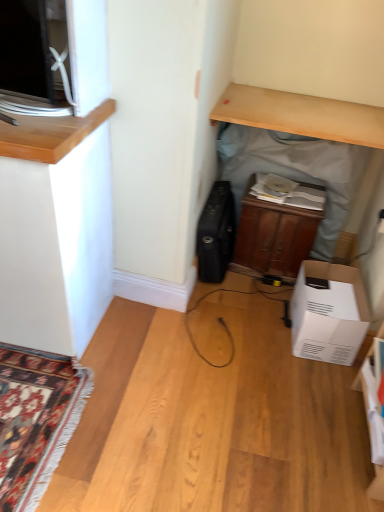
This screenshot has width=384, height=512. Describe the element at coordinates (274, 234) in the screenshot. I see `wooden cabinet at center` at that location.

What do you see at coordinates (216, 233) in the screenshot?
I see `black matte suitcase at center` at bounding box center [216, 233].

Where is `light wood desk at upper center`? This screenshot has width=384, height=512. light wood desk at upper center is located at coordinates (301, 115).

Considering the relative sizes of black matte suitcase at center and light wood desk at upper center in the image provided, is black matte suitcase at center smaller than light wood desk at upper center?

Actually, black matte suitcase at center might be larger than light wood desk at upper center.

In terms of height, does black matte suitcase at center look taller or shorter compared to light wood desk at upper center?

Considering their sizes, black matte suitcase at center has more height than light wood desk at upper center.

Which is closer to the camera, (231, 248) or (343, 115)?

The point (343, 115) is in front.

What are the coordinates of `desk above the black matte suitcase at center (from the image's perspective)` in the screenshot? It's located at click(x=301, y=115).

Is black matte suitcase at center beside wooden cabinet at center?

black matte suitcase at center is not next to wooden cabinet at center, and they're not touching.

Which of these two, black matte suitcase at center or wooden cabinet at center, is bigger?

With larger size is wooden cabinet at center.

How different are the orientations of black matte suitcase at center and wooden cabinet at center in degrees?

The angle between the facing direction of black matte suitcase at center and the facing direction of wooden cabinet at center is 5.87 degrees.

Is wooden cabinet at center touching black matte suitcase at center?

No, wooden cabinet at center is not making contact with black matte suitcase at center.

Who is taller, wooden cabinet at center or black matte suitcase at center?

Standing taller between the two is wooden cabinet at center.

Does point (287, 276) come in front of point (218, 253)?

No, (287, 276) is further to viewer.

From the image's perspective, relative to wooden cabinet at center, is white cardboard box at lower right above or below?

Clearly, from the image's perspective, white cardboard box at lower right is below wooden cabinet at center.

Consider the image. Is white cardboard box at lower right oriented away from wooden cabinet at center?

Correct, white cardboard box at lower right is looking away from wooden cabinet at center.

Is point (355, 293) in front of point (247, 239)?

That is True.

Is point (259, 95) behind point (200, 233)?

No, (259, 95) is closer to viewer.

Does wooden cabinet at center have a lesser width compared to black matte suitcase at center?

Yes.

From the image's perspective, which is below, wooden cabinet at center or black matte suitcase at center?

black matte suitcase at center, from the image's perspective.

At what (x,y) coordinates should I click in order to perform the action: click on desk on the right of wooden cabinet at center. Please return your answer as a coordinate pair (x, y). The image size is (384, 512). Looking at the image, I should click on (301, 115).

Consider the image. Which is correct: light wood desk at upper center is inside wooden cabinet at center, or outside of it?

light wood desk at upper center is not enclosed by wooden cabinet at center.

Looking at this image, which is more to the right, light wood desk at upper center or wooden cabinet at center?

From the viewer's perspective, light wood desk at upper center appears more on the right side.

Which of these two, light wood desk at upper center or wooden cabinet at center, stands taller?

wooden cabinet at center is taller.

In the scene shown: From the image's perspective, which is below, wooden cabinet at center or white cardboard box at lower right?

white cardboard box at lower right.

Is wooden cabinet at center touching white cardboard box at lower right?

No.

From a real-world perspective, is wooden cabinet at center physically below white cardboard box at lower right?

No, from a real-world perspective, wooden cabinet at center is not below white cardboard box at lower right.

Is point (241, 222) closer or farther from the camera than point (333, 313)?

Point (241, 222) is positioned farther from the camera compared to point (333, 313).

The width and height of the screenshot is (384, 512). Find the location of `desk that is on the right side of black matte suitcase at center`. desk that is on the right side of black matte suitcase at center is located at coordinates (301, 115).

Where is `appliance lying above the wooden cabinet at center (from the image's perspective)`? The image size is (384, 512). appliance lying above the wooden cabinet at center (from the image's perspective) is located at coordinates (216, 233).

Which object lies nearer to the anchor point light wood desk at upper center, white cardboard box at lower right or wooden cabinet at center?

wooden cabinet at center.

From the image, which object appears to be nearer to light wood desk at upper center, wooden cabinet at center or black matte suitcase at center?

wooden cabinet at center is closer to light wood desk at upper center.

Considering their positions, is wooden cabinet at center positioned closer to light wood desk at upper center than black matte suitcase at center?

The object closer to light wood desk at upper center is wooden cabinet at center.

From the image, which object appears to be farther from white cardboard box at lower right, wooden cabinet at center or wooden cabinet at center?

wooden cabinet at center.

Which object lies nearer to the anchor point black matte suitcase at center, white cardboard box at lower right or wooden cabinet at center?

The object closer to black matte suitcase at center is white cardboard box at lower right.

Based on their spatial positions, is wooden cabinet at center or black matte suitcase at center closer to white cardboard box at lower right?

Based on the image, black matte suitcase at center appears to be nearer to white cardboard box at lower right.

Looking at the image, which one is located further to light wood desk at upper center, white cardboard box at lower right or wooden cabinet at center?

Based on the image, white cardboard box at lower right appears to be further to light wood desk at upper center.

From the image, which object appears to be nearer to white cardboard box at lower right, wooden cabinet at center or black matte suitcase at center?

wooden cabinet at center lies closer to white cardboard box at lower right than the other object.

I want to click on cabinetry between wooden cabinet at center and white cardboard box at lower right from top to bottom, so pyautogui.click(x=274, y=234).

Find the location of a particular element. Image resolution: width=384 pixels, height=512 pixels. appliance between wooden cabinet at center and white cardboard box at lower right in the vertical direction is located at coordinates (216, 233).

Locate an element on the screen. This screenshot has width=384, height=512. computer desk that lies between light wood desk at upper center and white cardboard box at lower right from top to bottom is located at coordinates (301, 115).

Image resolution: width=384 pixels, height=512 pixels. Find the location of `cabinetry between black matte suitcase at center and wooden cabinet at center from left to right`. cabinetry between black matte suitcase at center and wooden cabinet at center from left to right is located at coordinates (274, 234).